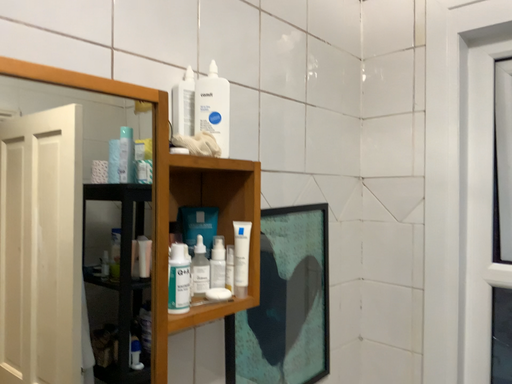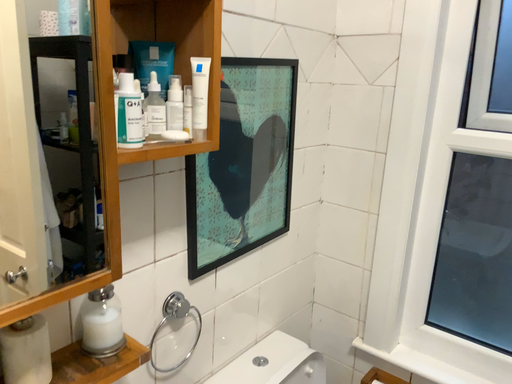
Question: How did the camera likely rotate when shooting the video?

Choices:
 (A) rotated upward
 (B) rotated downward

Answer: (B)